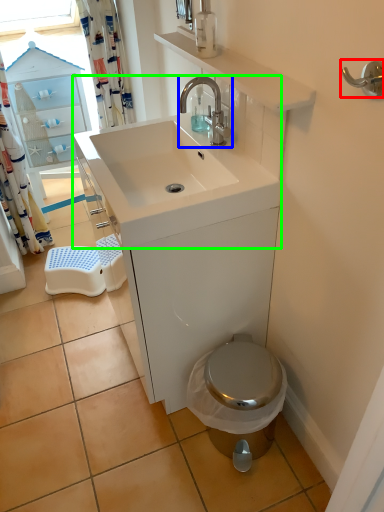
Question: Considering the real-world distances, which object is farthest from door handle (highlighted by a red box)? tap (highlighted by a blue box) or sink (highlighted by a green box)?

Choices:
 (A) tap
 (B) sink

Answer: (B)